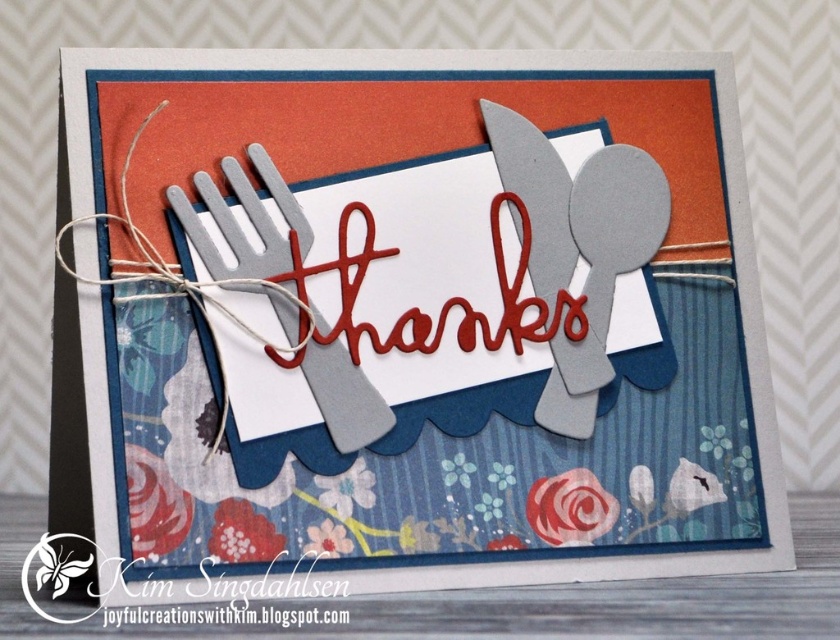
Which is above, matte gray fork at center or metallic silver fork at center?

metallic silver fork at center is higher up.

Image resolution: width=840 pixels, height=640 pixels. What do you see at coordinates (231, 227) in the screenshot?
I see `matte gray fork at center` at bounding box center [231, 227].

Who is more distant from viewer, (350, 412) or (565, 193)?

Positioned behind is point (565, 193).

The width and height of the screenshot is (840, 640). Find the location of `matte gray fork at center`. matte gray fork at center is located at coordinates (231, 227).

Is matte gray utensils at center bigger than metallic silver spoon at upper right?

Correct, matte gray utensils at center is larger in size than metallic silver spoon at upper right.

Who is more distant from viewer, [706,365] or [571,380]?

Point [706,365]

In order to click on matte gray utensils at center in this screenshot , I will do `click(416, 321)`.

I want to click on matte gray utensils at center, so click(x=416, y=321).

Between matte gray utensils at center and matte gray fork at center, which one appears on the left side from the viewer's perspective?

From the viewer's perspective, matte gray fork at center appears more on the left side.

Does point (752, 291) lie in front of point (337, 392)?

No, it is not.

Identify the location of matte gray utensils at center. This screenshot has height=640, width=840. (416, 321).

This screenshot has height=640, width=840. In order to click on matte gray utensils at center in this screenshot , I will do `click(416, 321)`.